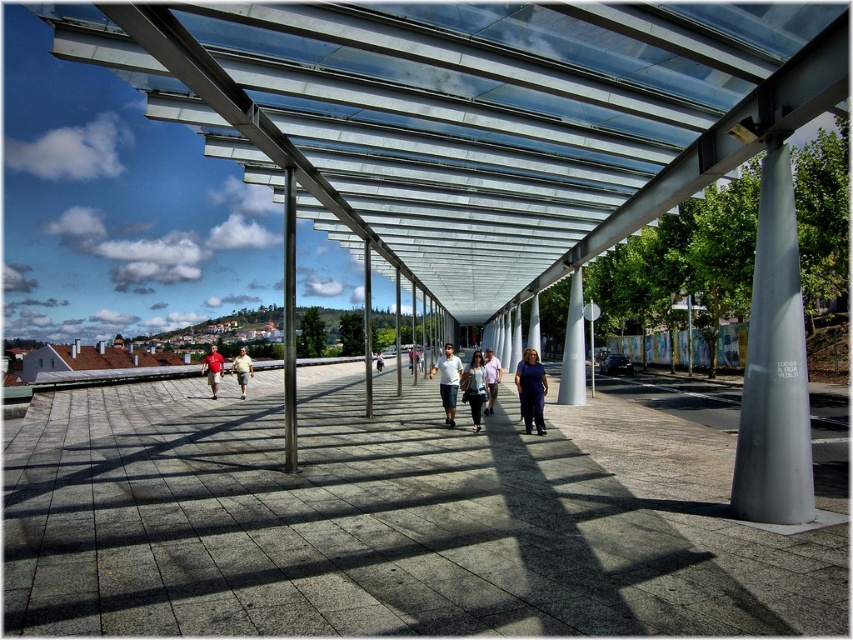
You are a photographer standing at the entrance of the walkway. You want to take a photo of the denim shorts at center without the satin silver column at right appearing in the frame. Is this possible given their positions?

The satin silver column at right is above the denim shorts at center, so if you position yourself to avoid looking upward, you can capture the denim shorts at center without the column obstructing the view.

You are standing at the entrance of the walkway and want to take a photo of the point at coordinates point (401, 608). Given that your camera has a maximum zoom range of 10 feet, will you be able to capture the point in focus without moving closer?

The distance of point (401, 608) from camera is 12.19 feet, which exceeds the camera maximum zoom range of 10 feet. Therefore, you won not be able to capture the point in focus without moving closer.